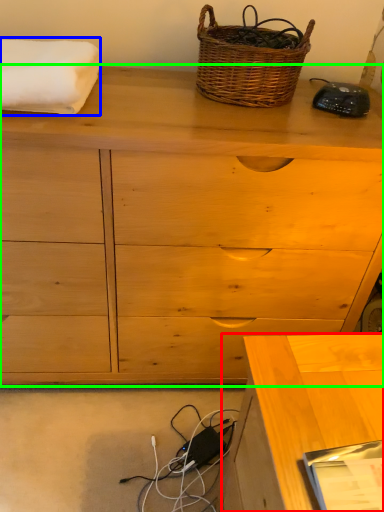
Question: Estimate the real-world distances between objects in this image. Which object is closer to desk (highlighted by a red box), bath towel (highlighted by a blue box) or chest of drawers (highlighted by a green box)?

Choices:
 (A) bath towel
 (B) chest of drawers

Answer: (B)